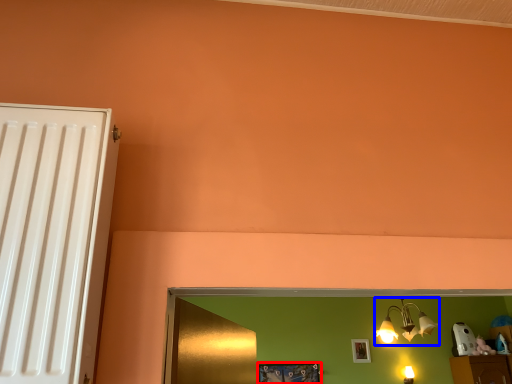
Question: Among these objects, which one is nearest to the camera, picture frame (highlighted by a red box) or lamp (highlighted by a blue box)?

Choices:
 (A) picture frame
 (B) lamp

Answer: (B)